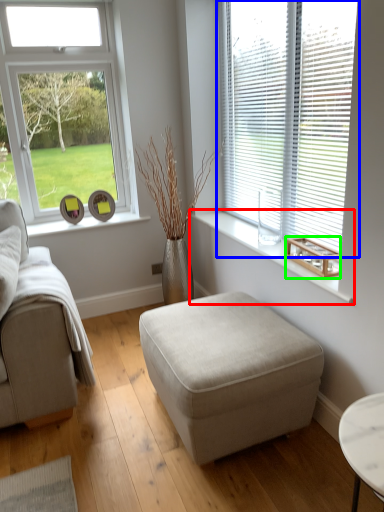
Question: Considering the real-world distances, which object is farthest from window sill (highlighted by a red box)? window (highlighted by a blue box) or wood (highlighted by a green box)?

Choices:
 (A) window
 (B) wood

Answer: (A)